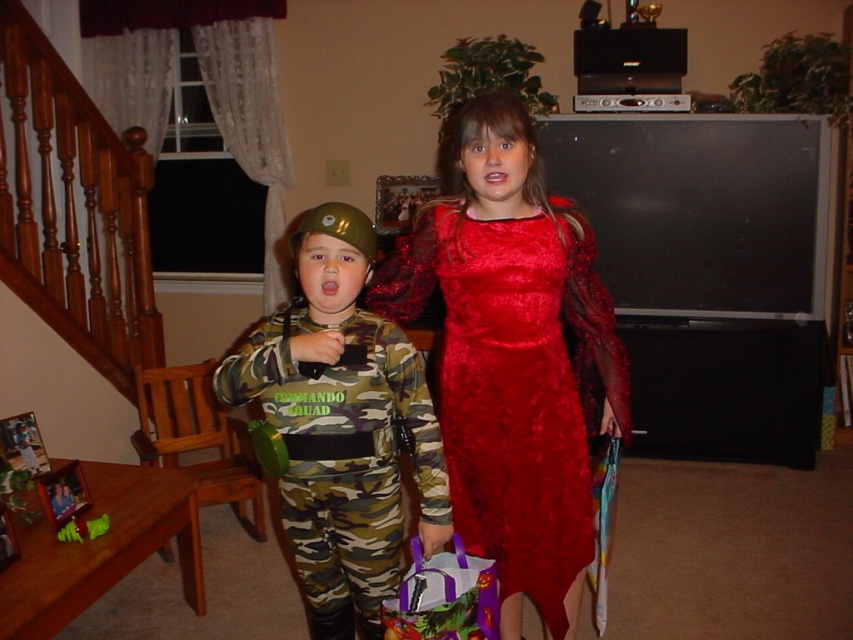
Question: Does shiny red dress at center have a greater width compared to camo fabric uniform at center?

Choices:
 (A) yes
 (B) no

Answer: (A)

Question: Which point is closer to the camera?

Choices:
 (A) camo fabric uniform at center
 (B) shiny red dress at center

Answer: (A)

Question: Among these objects, which one is nearest to the camera?

Choices:
 (A) shiny red dress at center
 (B) camo fabric uniform at center

Answer: (B)

Question: Does shiny red dress at center have a larger size compared to camo fabric uniform at center?

Choices:
 (A) yes
 (B) no

Answer: (A)

Question: Does shiny red dress at center appear on the left side of camo fabric uniform at center?

Choices:
 (A) yes
 (B) no

Answer: (B)

Question: Which of the following is the farthest from the observer?

Choices:
 (A) camo fabric uniform at center
 (B) shiny red dress at center

Answer: (B)